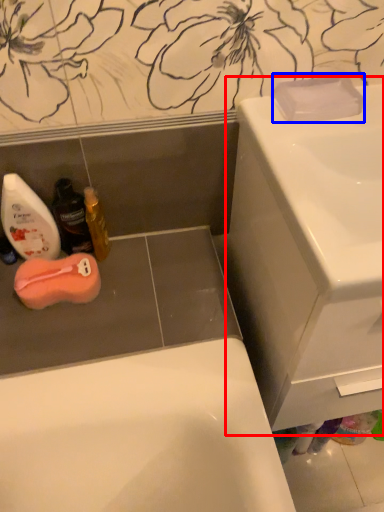
Question: Which point is closer to the camera, sink (highlighted by a red box) or soap (highlighted by a blue box)?

Choices:
 (A) sink
 (B) soap

Answer: (A)